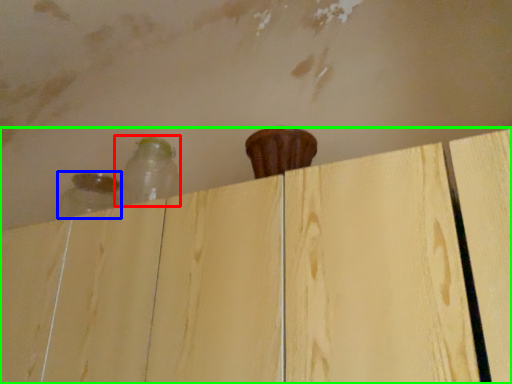
Question: Which object is the closest to the bottle (highlighted by a red box)? Choose among these: bottle (highlighted by a blue box) or dresser (highlighted by a green box).

Choices:
 (A) bottle
 (B) dresser

Answer: (A)